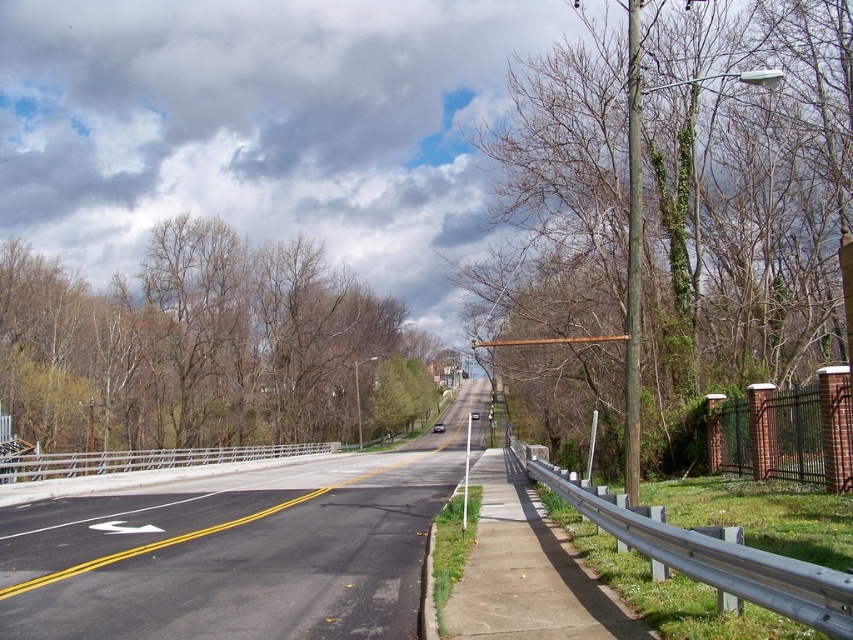
Question: Observing the image, what is the correct spatial positioning of green ivy-covered pole at right in reference to brown leafless tree at center?

Choices:
 (A) right
 (B) left

Answer: (A)

Question: Which of the following is the closest to the observer?

Choices:
 (A) click(225, 282)
 (B) click(117, 611)
 (C) click(645, 305)

Answer: (B)

Question: Considering the relative positions of green ivy-covered pole at right and brown leafless tree at center in the image provided, where is green ivy-covered pole at right located with respect to brown leafless tree at center?

Choices:
 (A) above
 (B) below

Answer: (A)

Question: Which of the following is the farthest from the observer?

Choices:
 (A) brown leafless tree at center
 (B) green ivy-covered pole at right

Answer: (A)

Question: Which point is farther to the camera?

Choices:
 (A) green ivy-covered pole at right
 (B) black asphalt road at center

Answer: (A)

Question: Considering the relative positions of brown leafless tree at center and black asphalt road at center in the image provided, where is brown leafless tree at center located with respect to black asphalt road at center?

Choices:
 (A) below
 (B) above

Answer: (B)